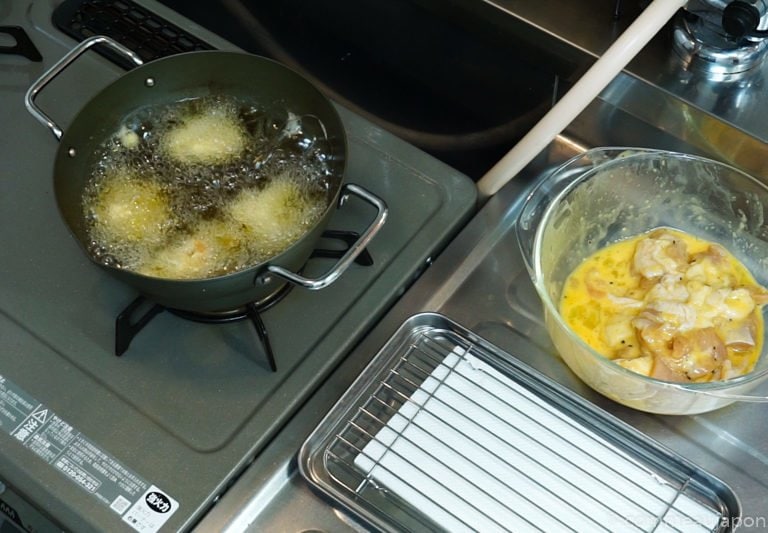
I want to click on stainless steel countertop, so click(498, 306).